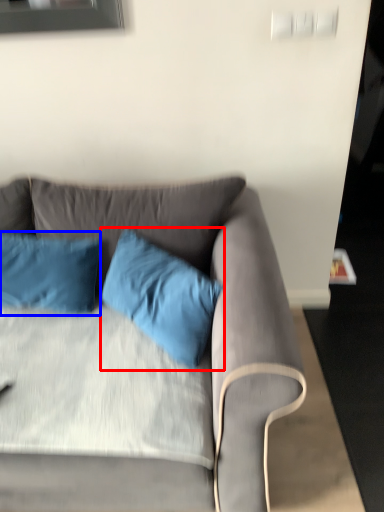
Question: Among these objects, which one is farthest to the camera, pillow (highlighted by a red box) or pillow (highlighted by a blue box)?

Choices:
 (A) pillow
 (B) pillow

Answer: (B)